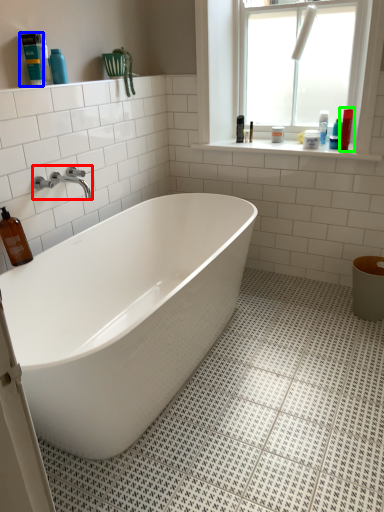
Question: Which object is the farthest from tap (highlighted by a red box)? Choose among these: cleaning product (highlighted by a blue box) or cleaning product (highlighted by a green box).

Choices:
 (A) cleaning product
 (B) cleaning product

Answer: (B)